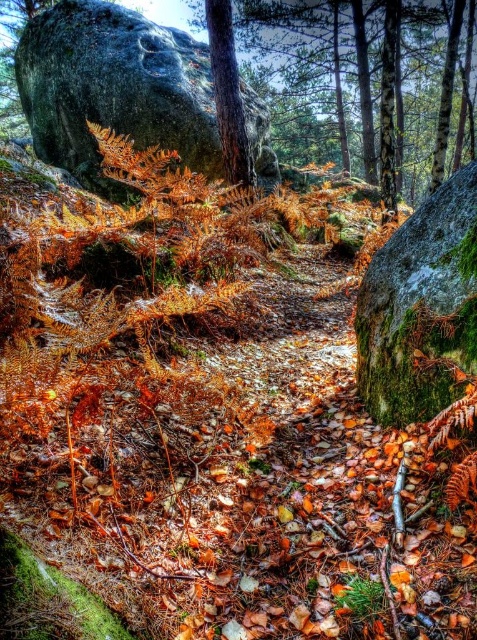
You are a hiker trying to navigate a narrow forest path bordered by rocks. You see the green mossy rock at upper left and the green mossy boulder at right. Which one is bigger?

The green mossy rock at upper left is larger in size compared to the green mossy boulder at right.

You are standing at the point labeled point at (147, 32). You want to walk to a point that is exactly 8.47 meters away from your current position. Is there a location in this forest scene that matches this distance?

Yes, the point labeled point at (147, 32) is exactly 8.47 meters away from your current position, so you can walk to that location.